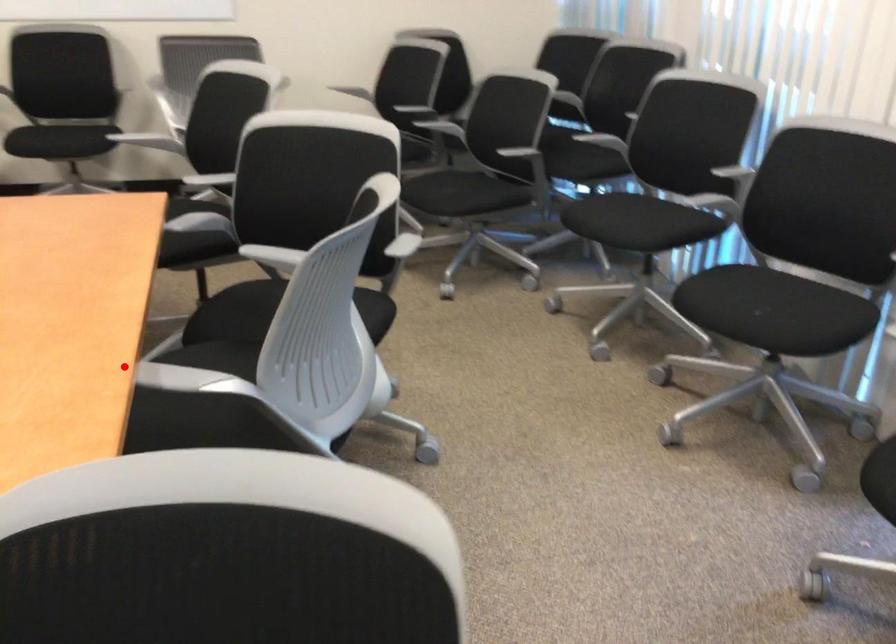
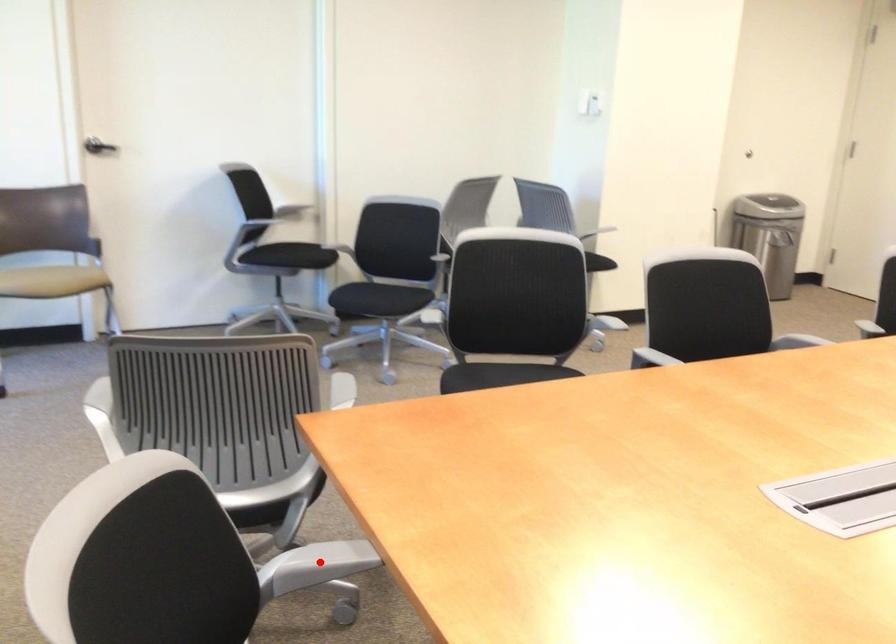
I am providing you with two images of the same scene from different viewpoints. A red point is marked on the first image and another point is marked on the second image. Is the red point in image1 aligned with the point shown in image2?

Yes